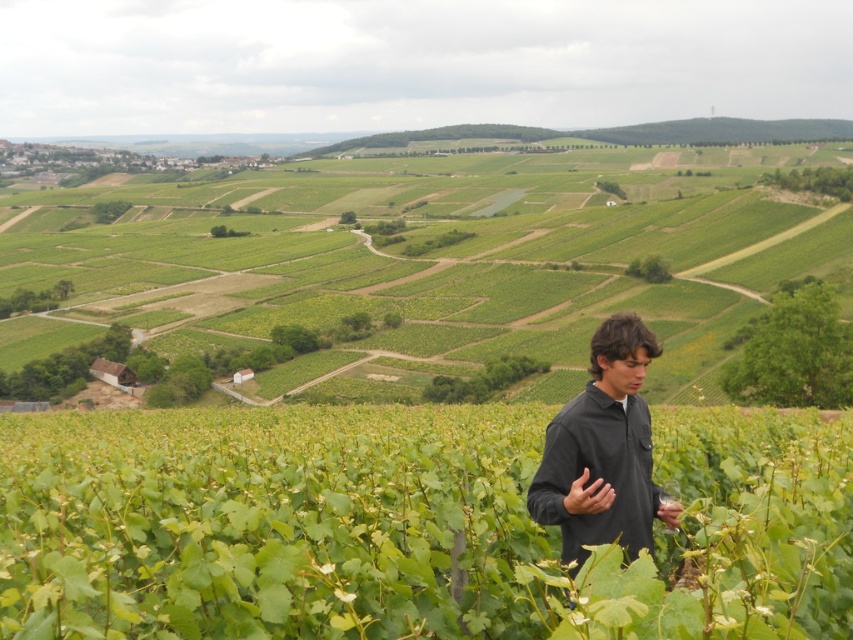
Between green leafy vines at center and green leafy vineyard at lower center, which one is positioned higher?

green leafy vineyard at lower center

Can you confirm if green leafy vines at center is positioned below green leafy vineyard at lower center?

Indeed, green leafy vines at center is positioned under green leafy vineyard at lower center.

Locate an element on the screen. green leafy vines at center is located at coordinates (270, 522).

Does green leafy vines at center have a greater height compared to black matte shirt at center?

Indeed, green leafy vines at center has a greater height compared to black matte shirt at center.

Does green leafy vines at center have a greater width compared to black matte shirt at center?

Yes.

What do you see at coordinates (270, 522) in the screenshot? I see `green leafy vines at center` at bounding box center [270, 522].

This screenshot has width=853, height=640. Identify the location of green leafy vines at center. (270, 522).

Image resolution: width=853 pixels, height=640 pixels. What do you see at coordinates (438, 257) in the screenshot? I see `green leafy vineyard at lower center` at bounding box center [438, 257].

Measure the distance between green leafy vineyard at lower center and black matte shirt at center.

Result: The distance of green leafy vineyard at lower center from black matte shirt at center is 424.13 meters.

The height and width of the screenshot is (640, 853). What do you see at coordinates (438, 257) in the screenshot?
I see `green leafy vineyard at lower center` at bounding box center [438, 257].

Where is `green leafy vineyard at lower center`? Image resolution: width=853 pixels, height=640 pixels. green leafy vineyard at lower center is located at coordinates (438, 257).